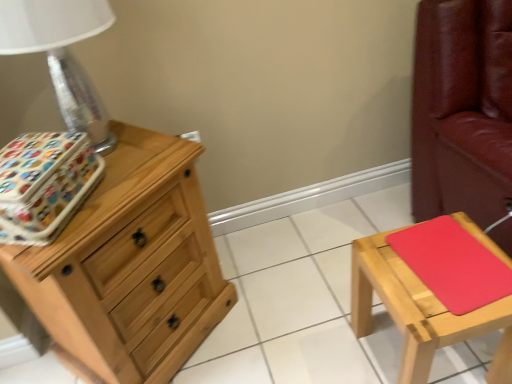
Question: Considering the relative sizes of natural wood chest of drawers at left and metallic silver table lamp at left in the image provided, is natural wood chest of drawers at left taller than metallic silver table lamp at left?

Choices:
 (A) no
 (B) yes

Answer: (B)

Question: Could you tell me if natural wood chest of drawers at left is facing metallic silver table lamp at left?

Choices:
 (A) yes
 (B) no

Answer: (B)

Question: From the image's perspective, is natural wood chest of drawers at left below metallic silver table lamp at left?

Choices:
 (A) yes
 (B) no

Answer: (A)

Question: From the image's perspective, is natural wood chest of drawers at left on metallic silver table lamp at left?

Choices:
 (A) no
 (B) yes

Answer: (A)

Question: Is natural wood chest of drawers at left to the left of metallic silver table lamp at left from the viewer's perspective?

Choices:
 (A) yes
 (B) no

Answer: (B)

Question: Choose the correct answer: Is patterned fabric storage box at left inside red matte pad at right or outside it?

Choices:
 (A) inside
 (B) outside

Answer: (B)

Question: Is patterned fabric storage box at left in front of or behind red matte pad at right in the image?

Choices:
 (A) behind
 (B) front

Answer: (B)

Question: Would you say patterned fabric storage box at left is to the left or to the right of red matte pad at right in the picture?

Choices:
 (A) right
 (B) left

Answer: (B)

Question: In terms of width, does patterned fabric storage box at left look wider or thinner when compared to red matte pad at right?

Choices:
 (A) thin
 (B) wide

Answer: (A)

Question: Is point (22, 206) positioned closer to the camera than point (362, 240)?

Choices:
 (A) closer
 (B) farther

Answer: (A)

Question: Relative to matte wood stool at right, is patterned fabric storage box at left in front or behind?

Choices:
 (A) behind
 (B) front

Answer: (B)

Question: Is patterned fabric storage box at left wider or thinner than matte wood stool at right?

Choices:
 (A) wide
 (B) thin

Answer: (B)

Question: In the image, is patterned fabric storage box at left on the left side or the right side of matte wood stool at right?

Choices:
 (A) left
 (B) right

Answer: (A)

Question: Looking at the image, does natural wood chest of drawers at left seem bigger or smaller compared to patterned fabric storage box at left?

Choices:
 (A) small
 (B) big

Answer: (B)

Question: From the image's perspective, relative to patterned fabric storage box at left, is natural wood chest of drawers at left above or below?

Choices:
 (A) below
 (B) above

Answer: (A)